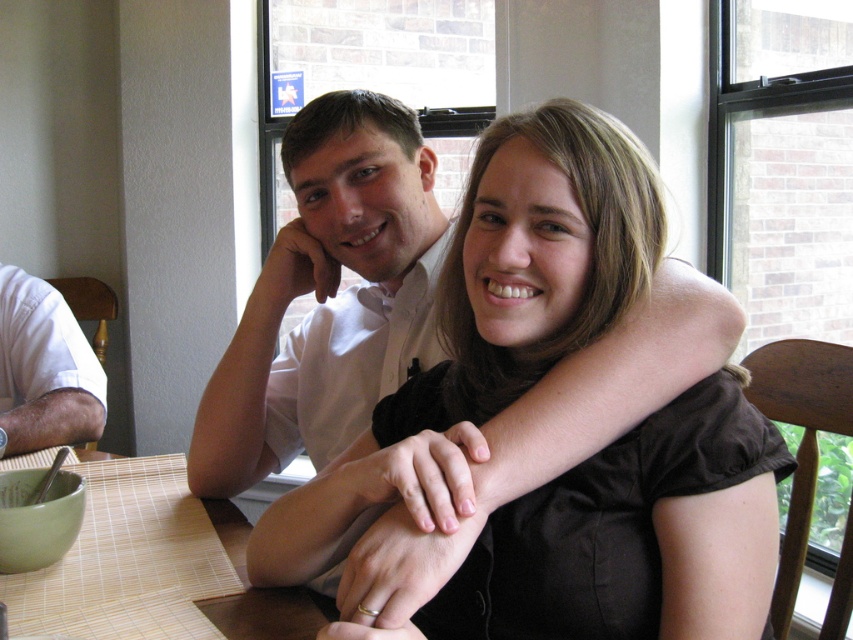
Which is below, bamboo placemat at lower left or white cotton shirt at left?

bamboo placemat at lower left is lower down.

Is bamboo placemat at lower left taller than white cotton shirt at left?

No, bamboo placemat at lower left is not taller than white cotton shirt at left.

At what (x,y) coordinates should I click in order to perform the action: click on bamboo placemat at lower left. Please return your answer as a coordinate pair (x, y). Looking at the image, I should click on (154, 566).

Can you confirm if black satin blouse at upper center is positioned below white cotton shirt at left?

Incorrect, black satin blouse at upper center is not positioned below white cotton shirt at left.

Identify the location of black satin blouse at upper center. This screenshot has width=853, height=640. (631, 534).

Is point (473, 634) farther from camera compared to point (51, 292)?

No, it is not.

Identify the location of black satin blouse at upper center. (631, 534).

Can you confirm if black satin blouse at upper center is positioned below bamboo placemat at lower left?

No.

Who is positioned more to the right, black satin blouse at upper center or bamboo placemat at lower left?

From the viewer's perspective, black satin blouse at upper center appears more on the right side.

Identify the location of black satin blouse at upper center. (631, 534).